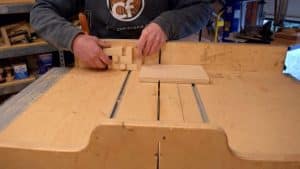
The image size is (300, 169). I want to click on board of wood, so click(183, 73).